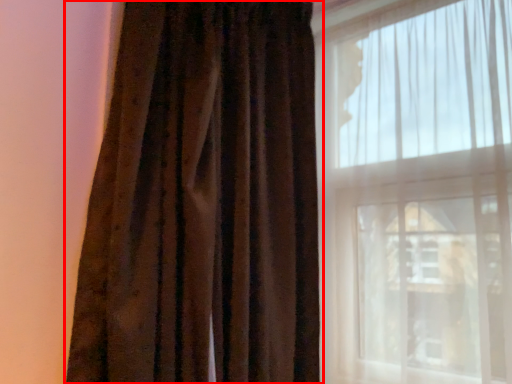
Question: From the image, what is the correct spatial relationship of curtain (annotated by the red box) in relation to window?

Choices:
 (A) left
 (B) right

Answer: (A)